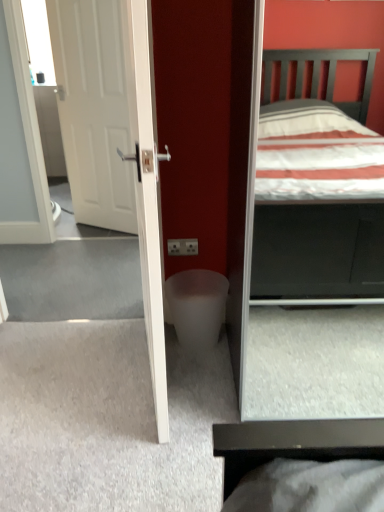
Locate an element on the screen. vacant space to the right of white frosted glass at center is located at coordinates (254, 351).